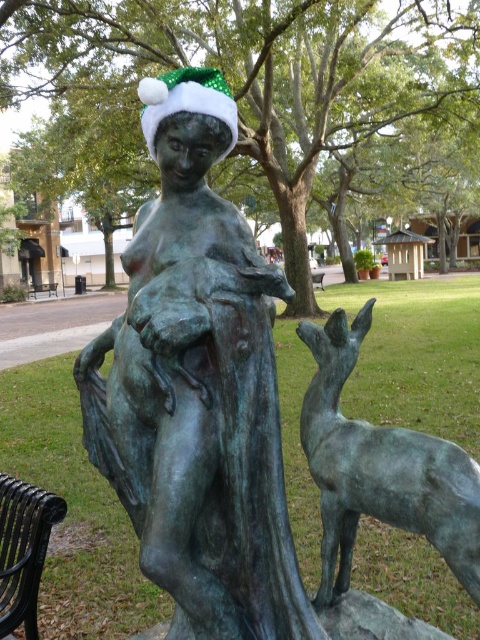
Question: Which point is farther from the camera taking this photo?

Choices:
 (A) (187, 96)
 (B) (23, 509)
 (C) (323, 273)

Answer: (C)

Question: Which object appears closest to the camera in this image?

Choices:
 (A) black wrought iron bench at lower left
 (B) black metal park bench at center
 (C) green patina deer at center

Answer: (C)

Question: Which is nearer to the black metal park bench at center?

Choices:
 (A) green patina deer at center
 (B) black wrought iron bench at lower left

Answer: (B)

Question: Where is bronze statue at center located in relation to green felt santa hat at upper center in the image?

Choices:
 (A) right
 (B) left

Answer: (B)

Question: Can you confirm if bronze statue at center is smaller than green felt santa hat at upper center?

Choices:
 (A) yes
 (B) no

Answer: (B)

Question: Is bronze statue at center above black metal park bench at center?

Choices:
 (A) yes
 (B) no

Answer: (B)